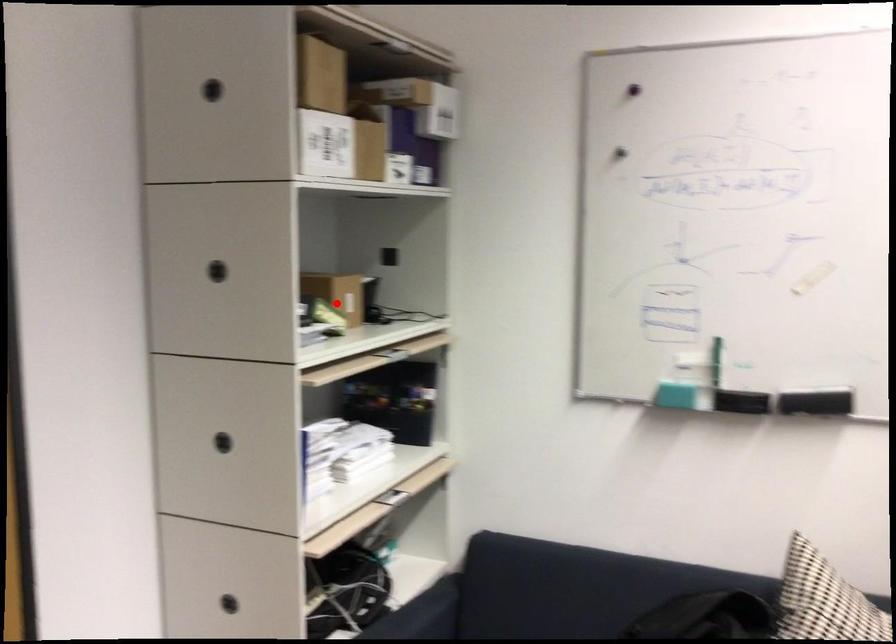
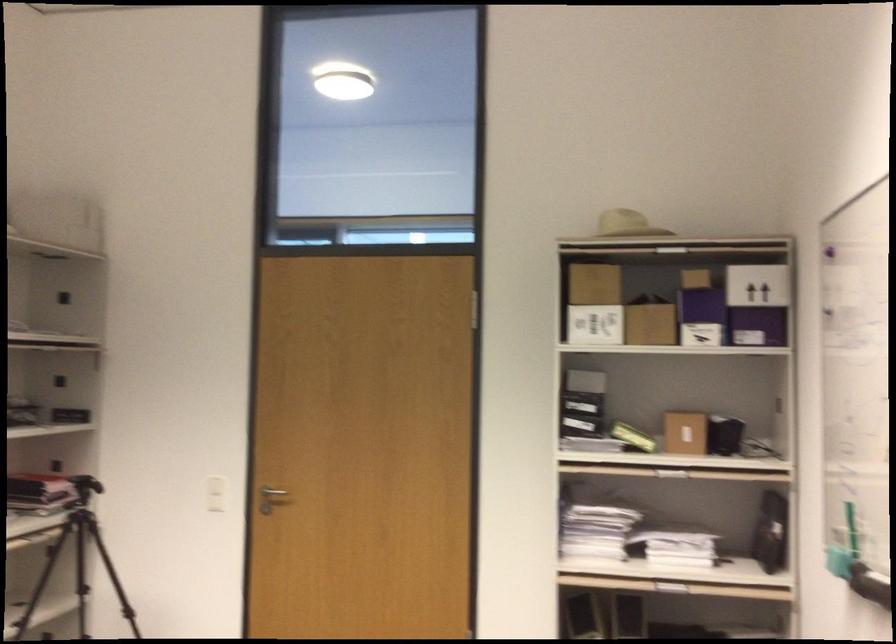
The point at the highlighted location is marked in the first image. Where is the corresponding point in the second image?

(684, 431)